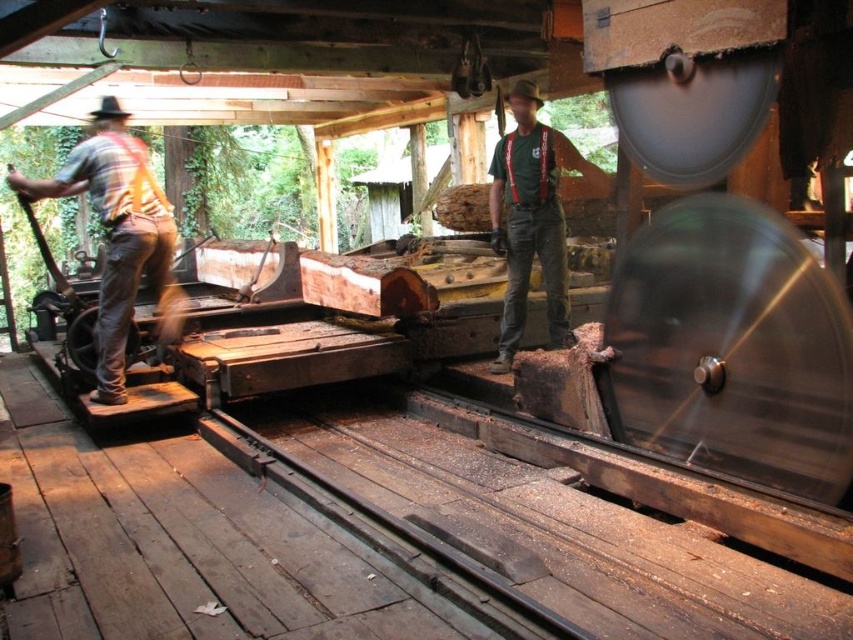
Question: Where is rustic wood shirt at left located in relation to green fabric shirt at center in the image?

Choices:
 (A) above
 (B) below

Answer: (B)

Question: Can you confirm if rustic wood shirt at left is positioned below green fabric shirt at center?

Choices:
 (A) yes
 (B) no

Answer: (A)

Question: In this image, where is rustic wood shirt at left located relative to green fabric shirt at center?

Choices:
 (A) left
 (B) right

Answer: (A)

Question: Which point is farther from the camera taking this photo?

Choices:
 (A) (525, 250)
 (B) (163, 291)

Answer: (A)